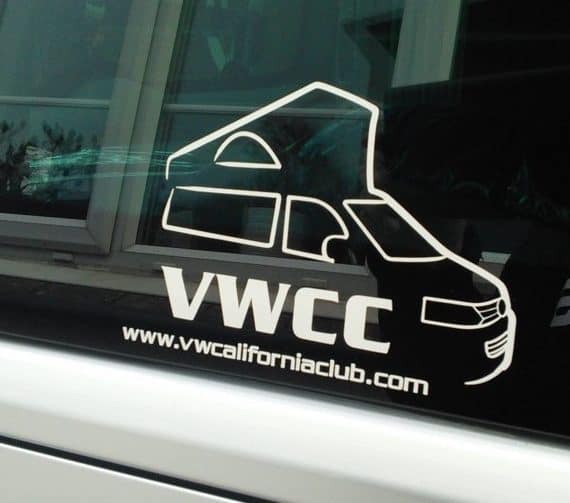
Find the location of a particular element. reflection of window is located at coordinates [59, 48], [275, 51].